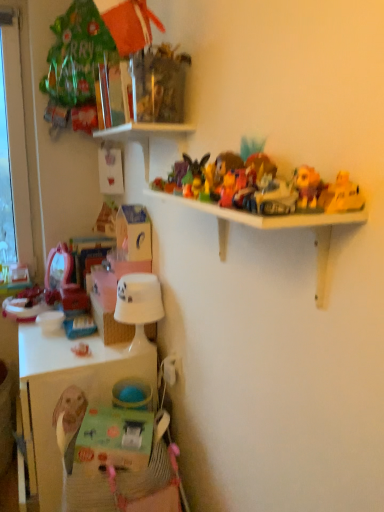
Identify the location of free space to the right of matte pink toy at lower left, the 1th toy positioned from the back. The image size is (384, 512). (113, 356).